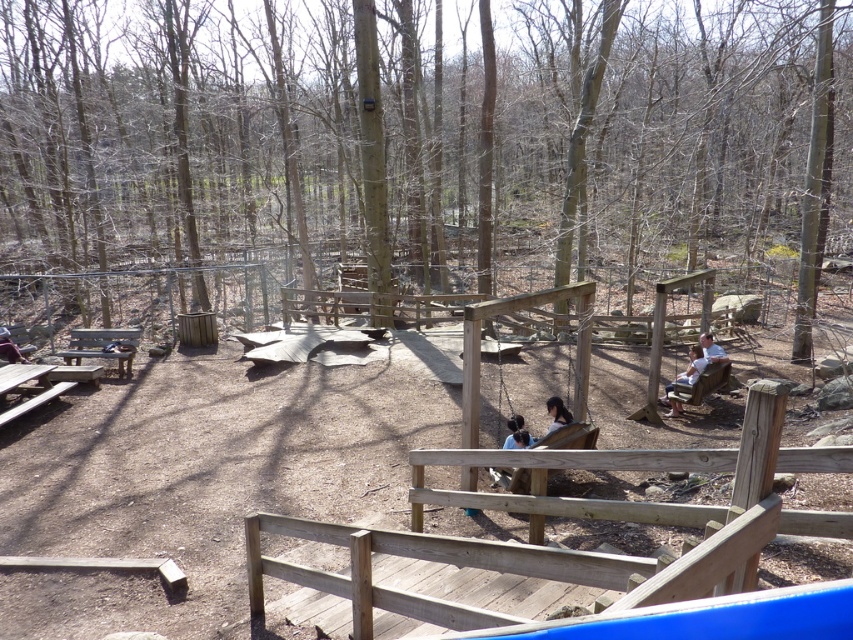
Question: Can you confirm if wooden swing at center is bigger than dark brown leather jacket at lower left?

Choices:
 (A) yes
 (B) no

Answer: (A)

Question: Which object is the closest to the brown wood tree at center?

Choices:
 (A) dark brown leather jacket at lower left
 (B) wooden swing at center
 (C) dark brown wooden swing at center
 (D) light brown wooden bench at lower right

Answer: (A)

Question: From the image, what is the correct spatial relationship of dark brown wooden swing at center in relation to dark brown leather jacket at lower left?

Choices:
 (A) below
 (B) above

Answer: (A)

Question: Does brown wood tree at center have a smaller size compared to dark brown leather jacket at lower left?

Choices:
 (A) no
 (B) yes

Answer: (A)

Question: Which point is closer to the camera taking this photo?

Choices:
 (A) (670, 401)
 (B) (97, 340)
 (C) (833, 451)
 (D) (306, 144)

Answer: (C)

Question: Which point appears farthest from the camera in this image?

Choices:
 (A) 691,356
 (B) 519,419
 (C) 4,356

Answer: (C)